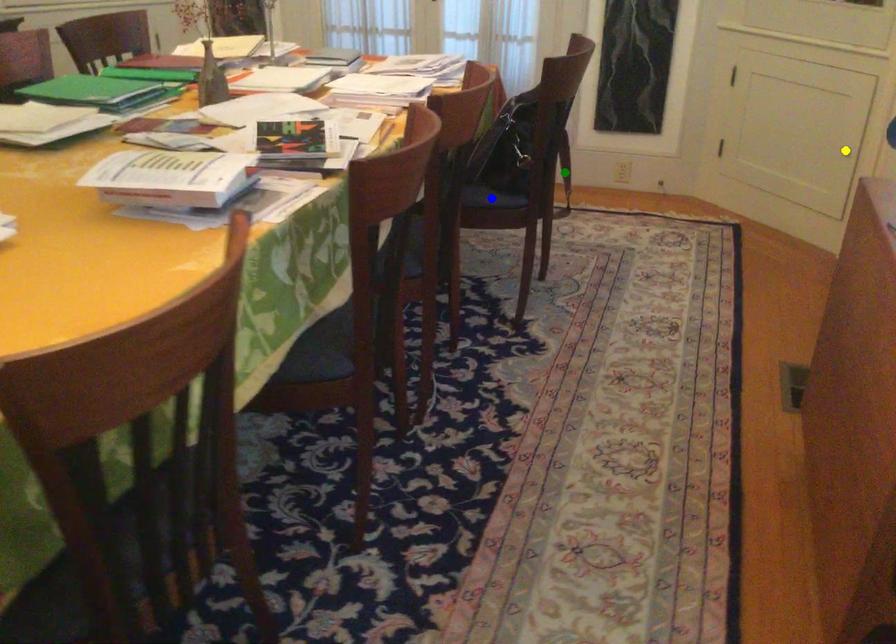
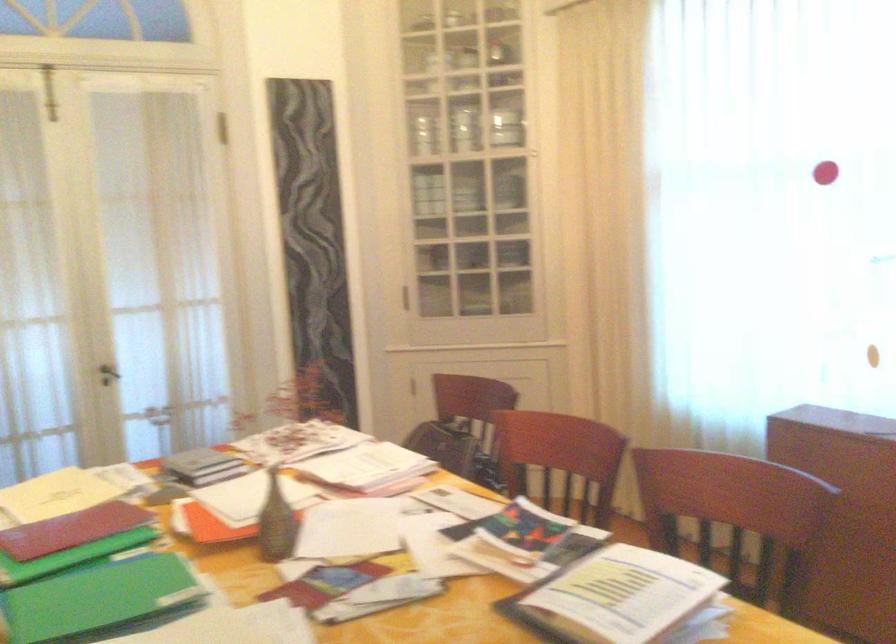
I am providing you with two images of the same scene from different viewpoints. Three points are marked in image1. Which point corresponds to a part or object that is occluded in image2?In image1, three points are marked. Which of them correspond to a part or object that is occluded in image2?Among the three points shown in image1, which one corresponds to a part or object that is no longer visible due to occlusion in image2?

blue point, green point, yellow point cannot be seen in image2.